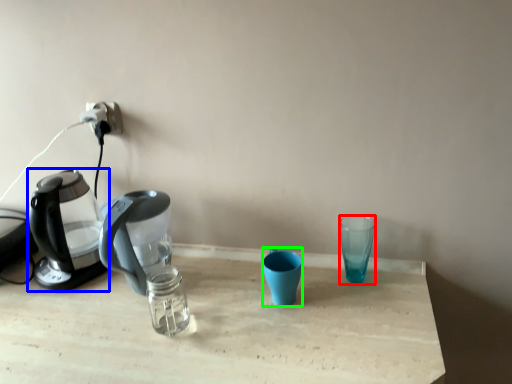
Question: Which object is positioned closest to coffee cup (highlighted by a red box)? Select from kettle (highlighted by a blue box) and coffee cup (highlighted by a green box).

Choices:
 (A) kettle
 (B) coffee cup

Answer: (B)